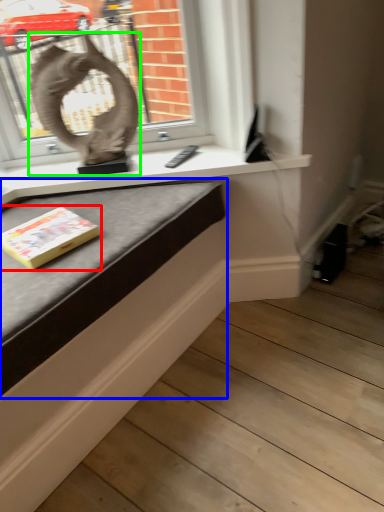
Question: Which object is positioned farthest from paperback book (highlighted by a red box)? Select from table (highlighted by a blue box) and sculpture (highlighted by a green box).

Choices:
 (A) table
 (B) sculpture

Answer: (B)